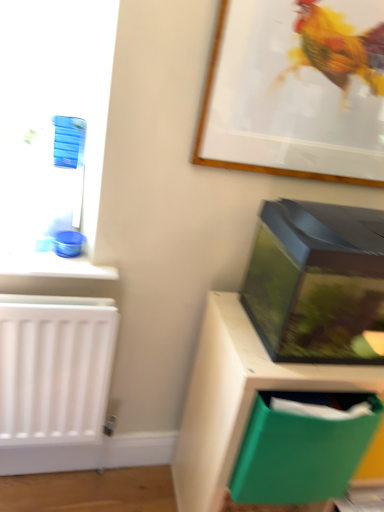
Question: Does wooden picture frame at upper center have a larger size compared to transparent plastic aquarium at right?

Choices:
 (A) no
 (B) yes

Answer: (A)

Question: Is transparent plastic aquarium at right surrounded by wooden picture frame at upper center?

Choices:
 (A) no
 (B) yes

Answer: (A)

Question: Considering the relative positions of wooden picture frame at upper center and transparent plastic aquarium at right in the image provided, is wooden picture frame at upper center in front of transparent plastic aquarium at right?

Choices:
 (A) yes
 (B) no

Answer: (B)

Question: Is wooden picture frame at upper center located outside transparent plastic aquarium at right?

Choices:
 (A) no
 (B) yes

Answer: (B)

Question: Can you confirm if wooden picture frame at upper center is taller than transparent plastic aquarium at right?

Choices:
 (A) no
 (B) yes

Answer: (B)

Question: From their relative heights in the image, would you say transparent plastic aquarium at right is taller or shorter than wooden picture frame at upper center?

Choices:
 (A) short
 (B) tall

Answer: (A)

Question: From the image's perspective, is transparent plastic aquarium at right above or below wooden picture frame at upper center?

Choices:
 (A) above
 (B) below

Answer: (B)

Question: Looking at the image, does transparent plastic aquarium at right seem bigger or smaller compared to wooden picture frame at upper center?

Choices:
 (A) small
 (B) big

Answer: (B)

Question: Is transparent plastic aquarium at right inside or outside of wooden picture frame at upper center?

Choices:
 (A) inside
 (B) outside

Answer: (B)

Question: Considering their positions, is green plastic file at lower right located in front of or behind green plastic folder at lower right?

Choices:
 (A) behind
 (B) front

Answer: (A)

Question: Based on their positions, is green plastic file at lower right located to the left or right of green plastic folder at lower right?

Choices:
 (A) left
 (B) right

Answer: (B)

Question: Is green plastic file at lower right wider or thinner than green plastic folder at lower right?

Choices:
 (A) thin
 (B) wide

Answer: (B)

Question: From a real-world perspective, relative to green plastic folder at lower right, is green plastic file at lower right vertically above or below?

Choices:
 (A) below
 (B) above

Answer: (A)

Question: Based on their positions, is transparent plastic aquarium at right located to the left or right of green plastic file at lower right?

Choices:
 (A) right
 (B) left

Answer: (A)

Question: From a real-world perspective, is transparent plastic aquarium at right positioned above or below green plastic file at lower right?

Choices:
 (A) below
 (B) above

Answer: (B)